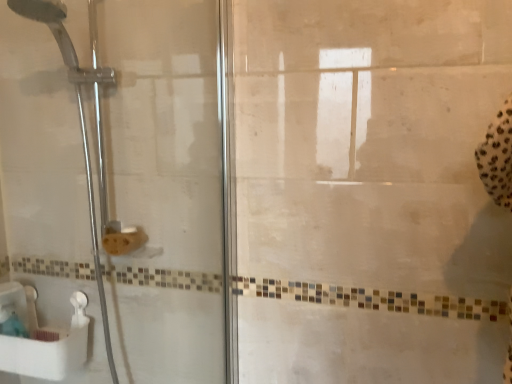
What is the approximate width of transparent glass shower door at left?

transparent glass shower door at left is 1.63 inches wide.

You are a GUI agent. You are given a task and a screenshot of the screen. Output one action in this format:
    pyautogui.click(x=<x>, y=<y>)
    Task: Click on the transparent glass shower door at left
    The width and height of the screenshot is (512, 384).
    Given the screenshot: What is the action you would take?
    pyautogui.click(x=161, y=188)

The image size is (512, 384). Describe the element at coordinates (161, 188) in the screenshot. I see `transparent glass shower door at left` at that location.

This screenshot has width=512, height=384. Find the location of `transparent glass shower door at left`. transparent glass shower door at left is located at coordinates (161, 188).